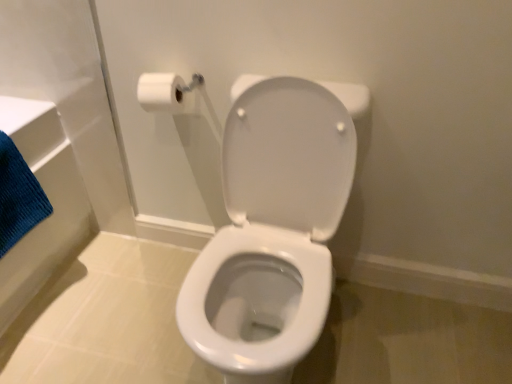
Locate an element on the screen. Image resolution: width=512 pixels, height=384 pixels. free space to the right of white glossy toilet at center is located at coordinates (395, 334).